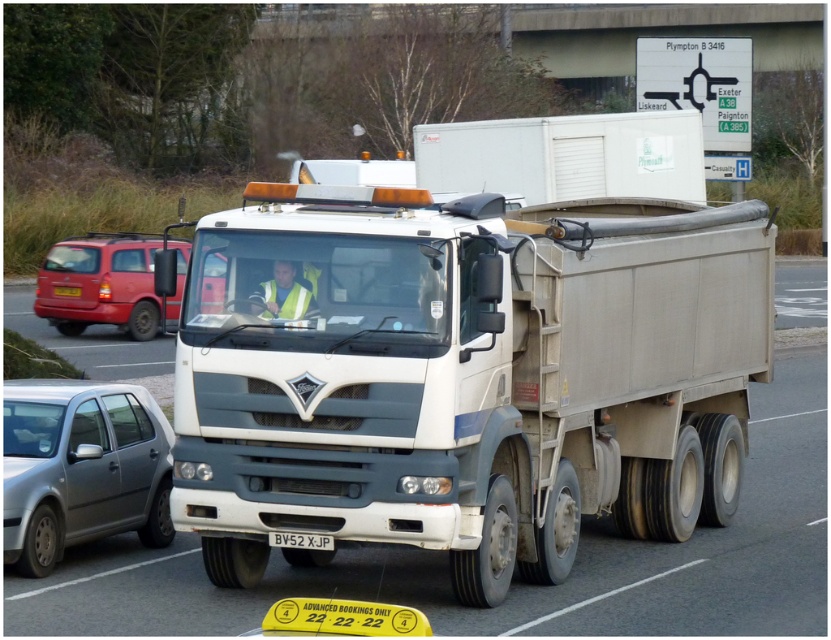
Can you confirm if white matte trailer truck at center is positioned above satin silver car at lower left?

Indeed, white matte trailer truck at center is positioned over satin silver car at lower left.

Does white matte trailer truck at center have a greater width compared to satin silver car at lower left?

In fact, white matte trailer truck at center might be narrower than satin silver car at lower left.

Who is more distant from viewer, (199, 323) or (111, 508)?

Point (111, 508)

I want to click on white matte trailer truck at center, so point(463,376).

Who is lower down, satin silver car at lower left or black plastic license plate at center?

satin silver car at lower left

Is satin silver car at lower left above black plastic license plate at center?

Actually, satin silver car at lower left is below black plastic license plate at center.

Is point (119, 448) positioned behind point (74, 296)?

No, (119, 448) is in front of (74, 296).

Where is `satin silver car at lower left`? Image resolution: width=831 pixels, height=640 pixels. satin silver car at lower left is located at coordinates (81, 467).

Does white matte trailer truck at center appear over white plastic license plate at center?

Correct, white matte trailer truck at center is located above white plastic license plate at center.

Between point (244, 225) and point (284, 545), which one is positioned behind?

Point (244, 225)

The width and height of the screenshot is (831, 640). What do you see at coordinates (463, 376) in the screenshot?
I see `white matte trailer truck at center` at bounding box center [463, 376].

The height and width of the screenshot is (640, 831). I want to click on white matte trailer truck at center, so click(x=463, y=376).